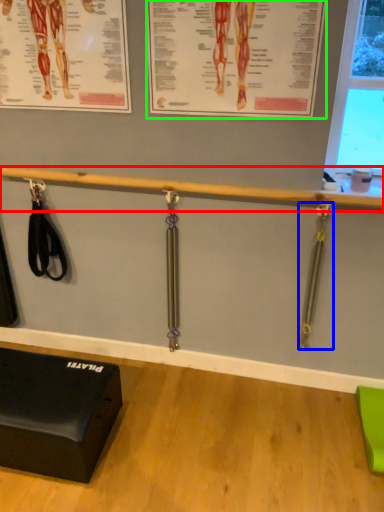
Question: Based on their relative distances, which object is farther from beam (highlighted by a red box)? Choose from weight (highlighted by a blue box) and poster page (highlighted by a green box).

Choices:
 (A) weight
 (B) poster page

Answer: (A)